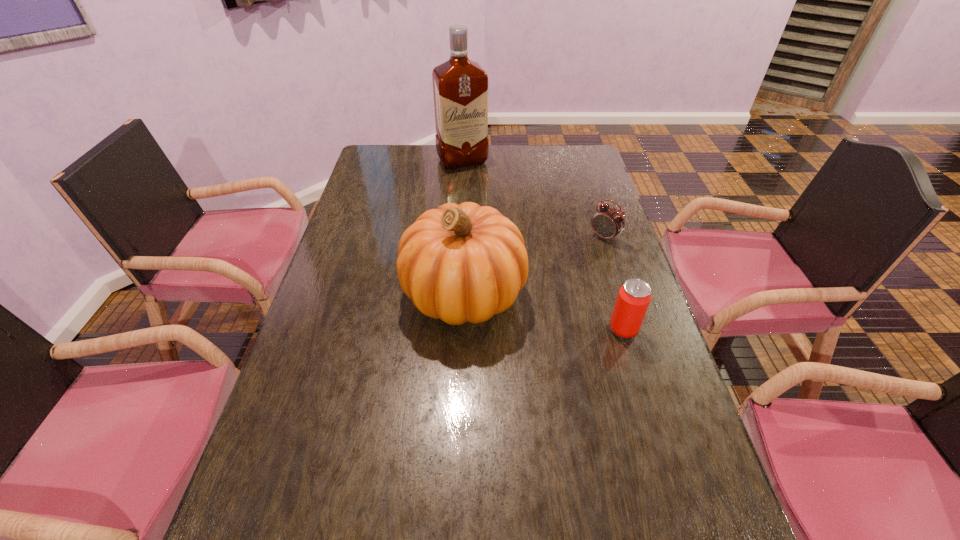
Where is `vacant space located on the front label of the farthest object`? This screenshot has height=540, width=960. vacant space located on the front label of the farthest object is located at coordinates (499, 222).

Where is `free space located on the front label of the farthest object`? This screenshot has width=960, height=540. free space located on the front label of the farthest object is located at coordinates [x=490, y=206].

The height and width of the screenshot is (540, 960). I want to click on free space located 0.200m on the front label of the farthest object, so click(486, 200).

Locate an element on the screen. The height and width of the screenshot is (540, 960). object positioned at the far edge is located at coordinates (460, 86).

You are a GUI agent. You are given a task and a screenshot of the screen. Output one action in this format:
    pyautogui.click(x=<x>, y=<y>)
    Task: Click on the beer can located at the right edge
    This screenshot has width=960, height=540.
    Given the screenshot: What is the action you would take?
    coord(634,297)

Find the location of a particular element. The image size is (960, 540). alarm clock present at the right edge is located at coordinates (607, 222).

Where is `free space at the far edge of the desktop`? This screenshot has width=960, height=540. free space at the far edge of the desktop is located at coordinates (485, 167).

Where is `free space at the near edge of the desktop`? The image size is (960, 540). free space at the near edge of the desktop is located at coordinates (581, 502).

In the image, there is a desktop. At what (x,y) coordinates should I click in order to perform the action: click on free space at the left edge. Please return your answer as a coordinate pair (x, y). The width and height of the screenshot is (960, 540). Looking at the image, I should click on (362, 187).

In the image, there is a desktop. Where is `vacant space at the right edge`? This screenshot has width=960, height=540. vacant space at the right edge is located at coordinates (617, 394).